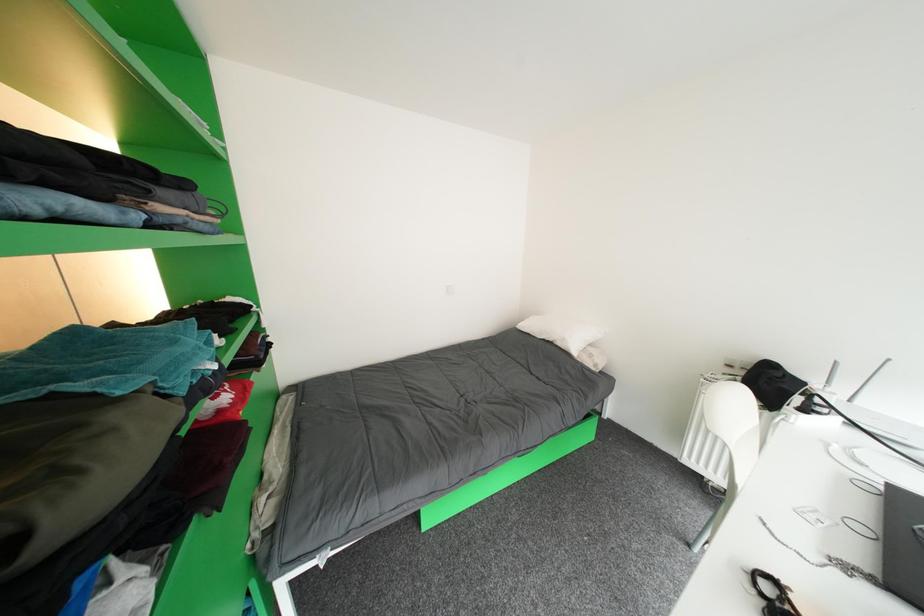
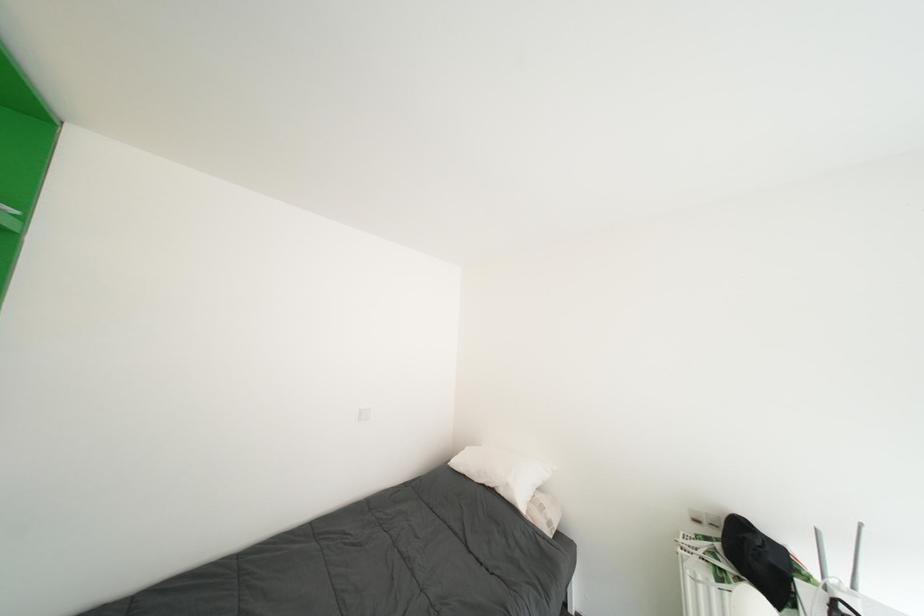
Question: The first image is from the beginning of the video and the second image is from the end. How did the camera likely rotate when shooting the video?

Choices:
 (A) Left
 (B) Right
 (C) Up
 (D) Down

Answer: (C)